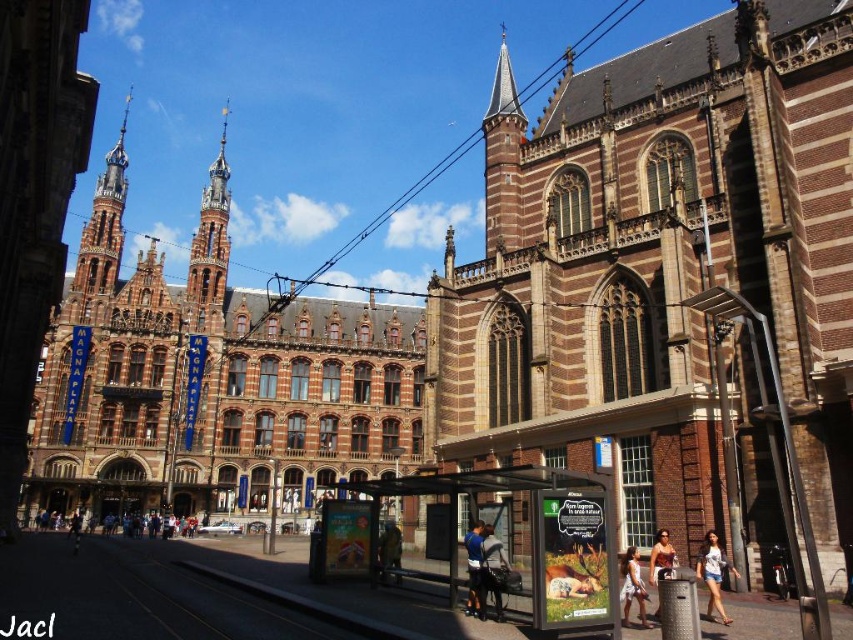
You are standing in the square between the two buildings and want to take a photo of the brown brick church at center and the polished copper spire at upper left. Which building should you position yourself closer to in order to capture both in the frame?

You should position yourself closer to the polished copper spire at upper left because the brown brick church at center is to the right of it, allowing both to be included in the frame.